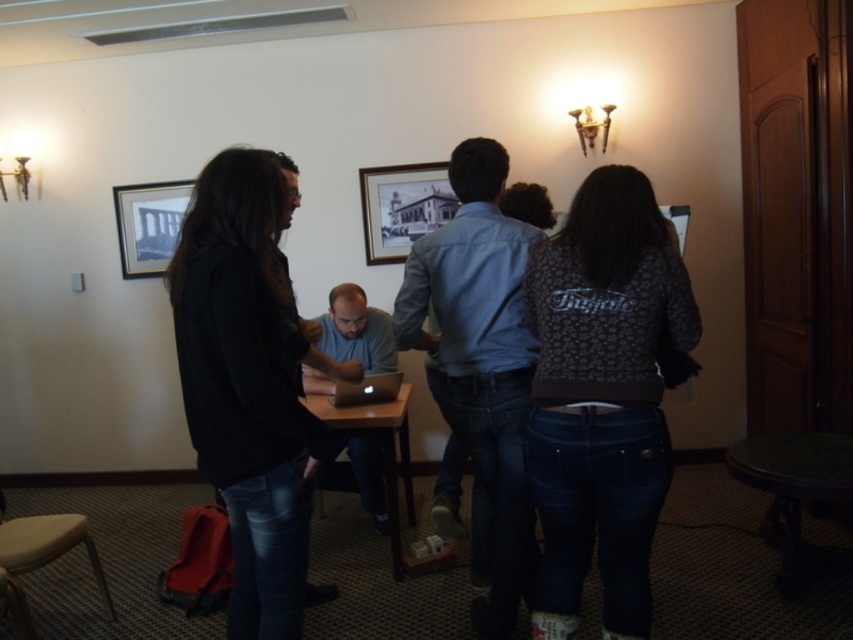
You are organizing a small meeting in this room and need to ensure there is enough space for everyone. Given the objects present, can the patterned fabric jacket at back right be moved to make more space for the wooden table at center?

The patterned fabric jacket at back right occupies less space than the wooden table at center, so moving it would free up space, allowing more room for the wooden table at center.